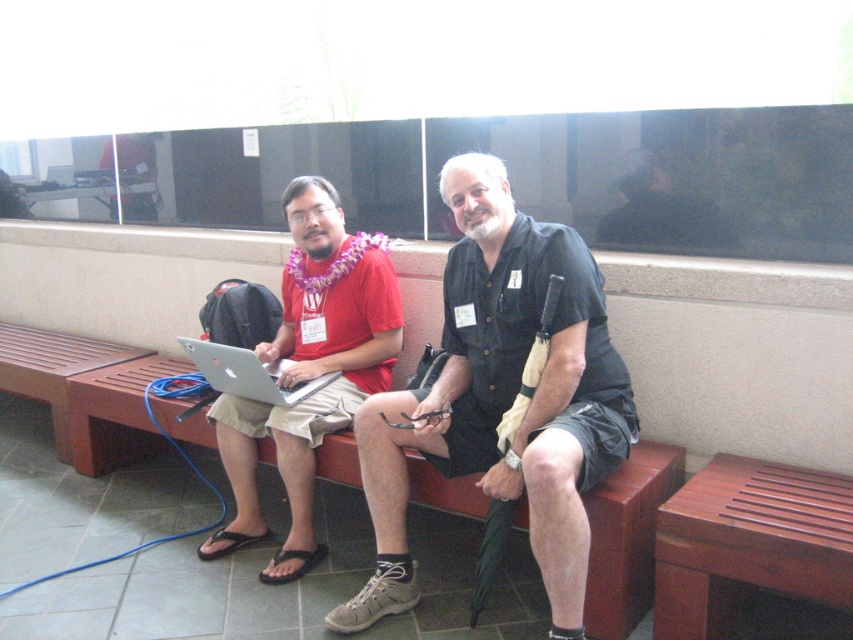
You are an architect designing a layout for a public space. You need to place a bench in such a way that the matte black shirt at center is visible from the entrance. Where should you position the bench relative to the entrance?

The matte black shirt at center is located at coordinates point (x=502, y=397), so positioning the bench facing towards that coordinate from the entrance would ensure visibility.

You are an IT technician who needs to determine which laptop is suitable for a presentation. The requirement is that the laptop must have a taller screen to display more content. Based on the scene, which laptop between the matte black laptop at left and the silver metallic laptop at center should you choose?

The matte black laptop at left is taller than the silver metallic laptop at center, so you should choose the matte black laptop at left for the presentation because it has a taller screen to display more content.

You are trying to determine if the brown wooden bench at lower left can accommodate both the silver metallic laptop at center and a tablet that is 0.5 meters wide. Based on the scene description, can the bench hold both items without overlapping?

The brown wooden bench at lower left is wider than the silver metallic laptop at center. Since the tablet is 0.5 meters wide, and the bench is wider than the laptop, it is likely that the bench can accommodate both items without overlapping, provided they are arranged properly.